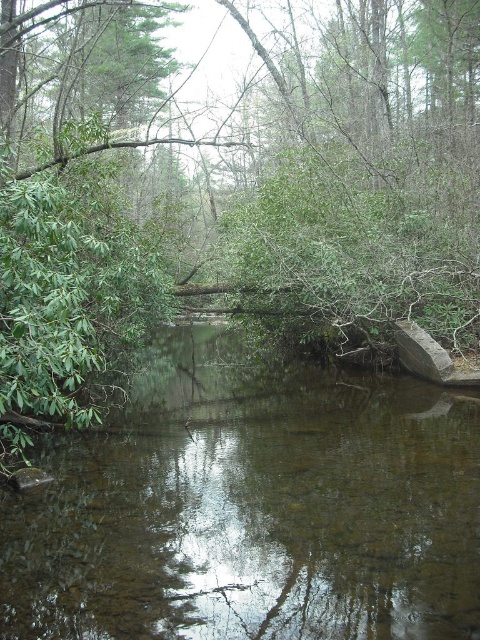
Question: Among these objects, which one is nearest to the camera?

Choices:
 (A) brown reflective water at center
 (B) green leafy tree at center

Answer: (A)

Question: Is green leafy tree at center bigger than brown reflective water at center?

Choices:
 (A) no
 (B) yes

Answer: (B)

Question: Can you confirm if green leafy tree at center is positioned to the right of brown reflective water at center?

Choices:
 (A) no
 (B) yes

Answer: (B)

Question: Does green leafy tree at center have a greater width compared to brown reflective water at center?

Choices:
 (A) yes
 (B) no

Answer: (A)

Question: Among these objects, which one is farthest from the camera?

Choices:
 (A) brown reflective water at center
 (B) green leafy tree at center

Answer: (B)